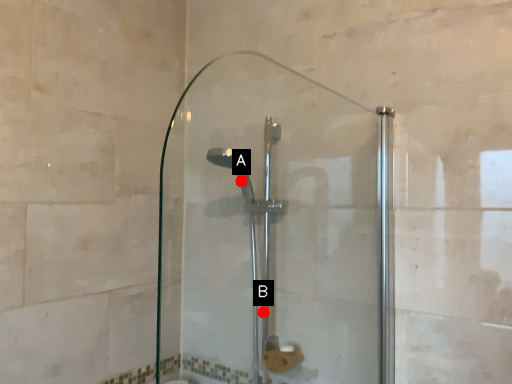
Question: Two points are circled on the image, labeled by A and B beside each circle. Which point is further to the camera?

Choices:
 (A) A is further
 (B) B is further

Answer: (A)